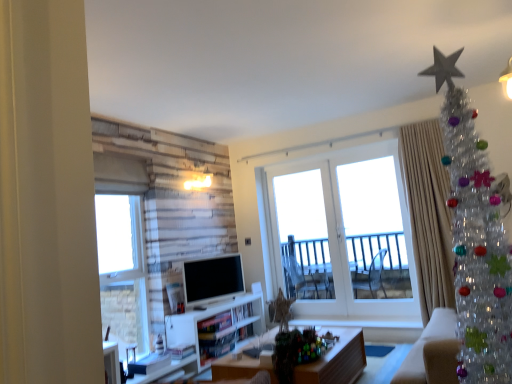
Question: Considering the positions of white glass door at center, which appears as the first window when viewed from the right, and white glossy door at center in the image, is white glass door at center, which appears as the first window when viewed from the right, wider or thinner than white glossy door at center?

Choices:
 (A) thin
 (B) wide

Answer: (A)

Question: From a real-world perspective, relative to white glossy door at center, is white glass door at center, which appears as the first window when viewed from the right, vertically above or below?

Choices:
 (A) above
 (B) below

Answer: (A)

Question: Which of these objects is positioned farthest from the silky beige curtain at right?

Choices:
 (A) wooden desk at center
 (B) white glossy television at center
 (C) white glass door at center, which appears as the first window when viewed from the right
 (D) clear plastic christmas tree at upper right
 (E) clear glass window at left, which appears as the 1th window when viewed from the front

Answer: (E)

Question: Based on their relative distances, which object is nearer to the wooden desk at center?

Choices:
 (A) silky beige curtain at right
 (B) clear plastic christmas tree at upper right
 (C) clear glass window at left, which appears as the 1th window when viewed from the front
 (D) white glossy door at center
 (E) white glass door at center, the first window in the back-to-front sequence

Answer: (A)